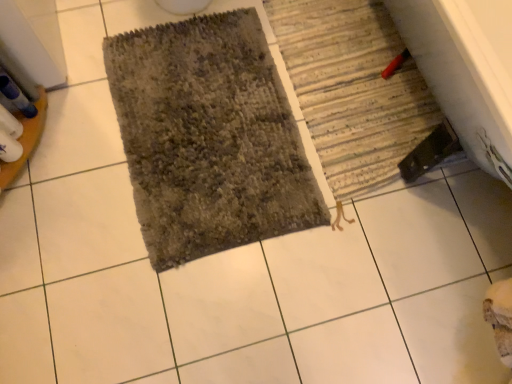
You are a GUI agent. You are given a task and a screenshot of the screen. Output one action in this format:
    pyautogui.click(x=<x>, y=<y>)
    Task: Click on the vacant space situated on the left part of textured gray bath mat at center, which is the 2th bath mat in right-to-left order
    This screenshot has width=512, height=384.
    Given the screenshot: What is the action you would take?
    click(x=76, y=131)